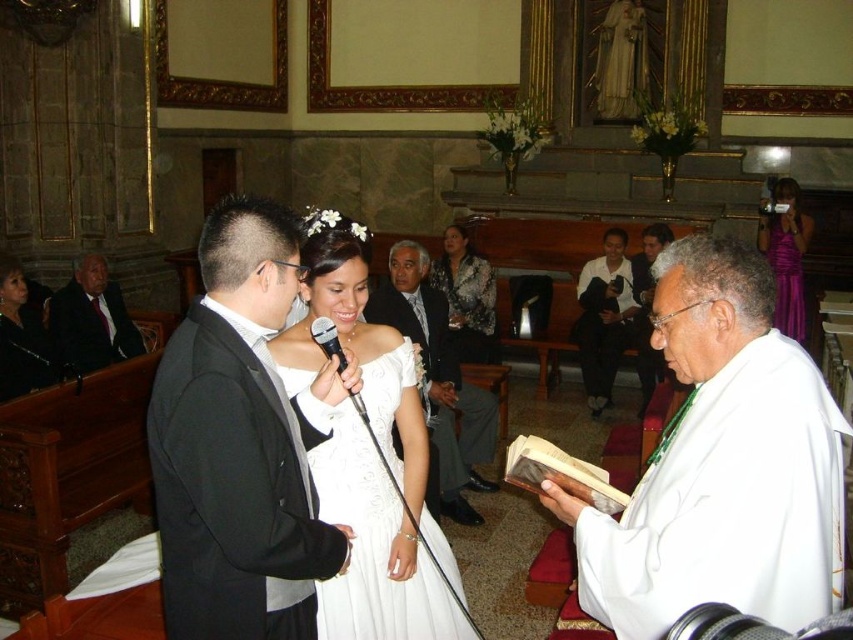
Which is more to the left, white cloth at right or floral-patterned dress at center?

floral-patterned dress at center is more to the left.

Is white cloth at right to the left of floral-patterned dress at center from the viewer's perspective?

Incorrect, white cloth at right is not on the left side of floral-patterned dress at center.

Is point (708, 534) positioned behind point (486, 308)?

No, (708, 534) is closer to viewer.

Locate an element on the screen. The width and height of the screenshot is (853, 640). white cloth at right is located at coordinates (721, 465).

Does floral-patterned dress at center lie behind black satin dress at left?

Yes, it is behind black satin dress at left.

Between floral-patterned dress at center and black satin dress at left, which one has less height?

black satin dress at left

Between point (450, 285) and point (21, 381), which one is positioned in front?

Positioned in front is point (21, 381).

Identify the location of floral-patterned dress at center. This screenshot has height=640, width=853. (466, 296).

Measure the distance from white cloth at right to white shirt at center.

white cloth at right is 7.73 meters from white shirt at center.

Who is more forward, (x=676, y=253) or (x=621, y=301)?

Point (x=676, y=253)

Find the location of a particular element. This screenshot has height=640, width=853. white cloth at right is located at coordinates (x=721, y=465).